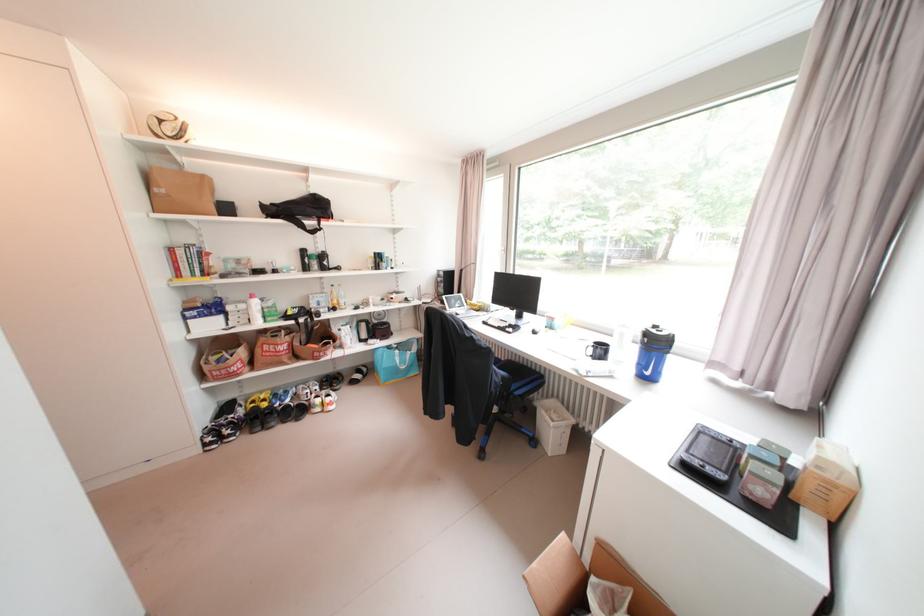
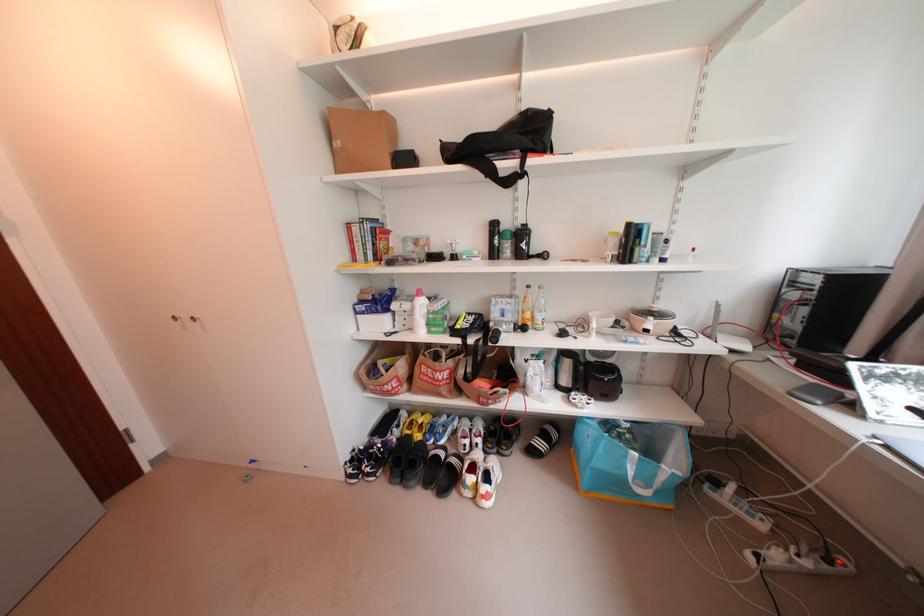
Where in the second image is the point corresponding to (247,323) from the first image?

(412, 326)